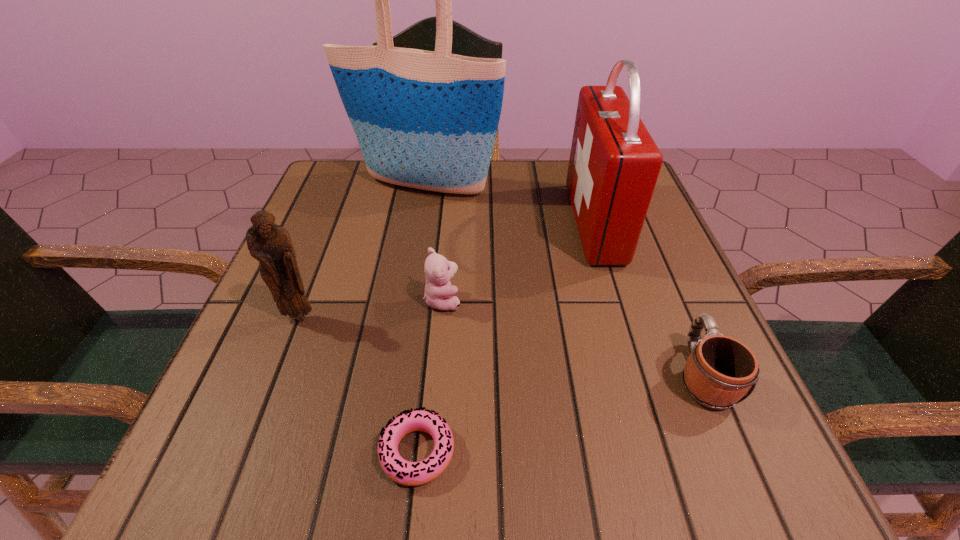
Where is `free spot at the left edge of the desktop`? This screenshot has width=960, height=540. free spot at the left edge of the desktop is located at coordinates (306, 295).

In the image, there is a desktop. At what (x,y) coordinates should I click in order to perform the action: click on vacant space at the right edge. Please return your answer as a coordinate pair (x, y). This screenshot has height=540, width=960. Looking at the image, I should click on (665, 287).

In the image, there is a desktop. What are the coordinates of `free space at the far left corner` in the screenshot? It's located at (333, 175).

Image resolution: width=960 pixels, height=540 pixels. What are the coordinates of `free area in between the tote bag and the figurine` in the screenshot? It's located at (362, 251).

This screenshot has width=960, height=540. Identify the location of free point between the fifth tallest object and the figurine. (501, 346).

This screenshot has height=540, width=960. I want to click on free area in between the tote bag and the second shortest object, so click(x=563, y=280).

The width and height of the screenshot is (960, 540). In order to click on empty location between the tallest object and the mug in this screenshot , I will do `click(563, 280)`.

The image size is (960, 540). What are the coordinates of `blank region between the nearest object and the fifth farthest object` in the screenshot? It's located at (560, 413).

At what (x,y) coordinates should I click in order to perform the action: click on empty location between the doughnut and the third tallest object. Please return your answer as a coordinate pair (x, y). Looking at the image, I should click on (359, 384).

The height and width of the screenshot is (540, 960). I want to click on free space that is in between the doughnut and the fourth tallest object, so click(x=430, y=376).